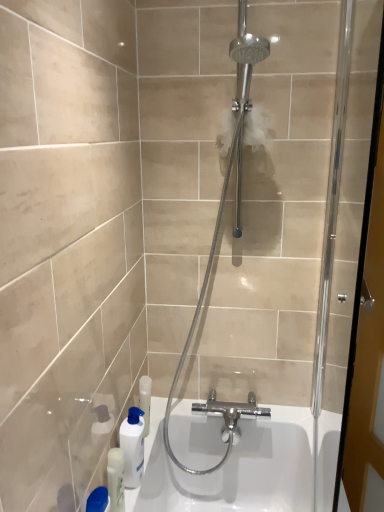
What do you see at coordinates (133, 447) in the screenshot? I see `white glossy bottle at lower left` at bounding box center [133, 447].

Find the location of a particular element. Image resolution: width=384 pixels, height=512 pixels. polished chrome shower head at center is located at coordinates click(x=223, y=206).

In order to click on white glossy bottle at lower left in this screenshot , I will do `click(116, 479)`.

Considering the sizes of objects polished chrome shower head at center and white glossy bottle at lower left in the image provided, who is shorter, polished chrome shower head at center or white glossy bottle at lower left?

white glossy bottle at lower left.

From a real-world perspective, which object stands above the other?

From a 3D spatial view, polished chrome shower head at center is above.

From the image's perspective, between polished chrome shower head at center and white glossy bottle at lower left, who is located below?

white glossy bottle at lower left appears lower in the image.

From the image's perspective, relative to white glossy bottle at lower left, is white glossy bottle at lower left above or below?

white glossy bottle at lower left is above white glossy bottle at lower left.

Is white glossy bottle at lower left at the right side of white glossy bottle at lower left?

Yes, white glossy bottle at lower left is to the right of white glossy bottle at lower left.

Looking at the image, does white glossy bottle at lower left seem bigger or smaller compared to white glossy bottle at lower left?

In the image, white glossy bottle at lower left appears to be larger than white glossy bottle at lower left.

From a real-world perspective, which object stands above the other?

From a 3D spatial view, polished chrome shower head at center is above.

Locate an element on the screen. toiletry to the left of polished chrome shower head at center is located at coordinates (116, 479).

Considering their positions, is polished chrome shower head at center located in front of or behind white glossy bottle at lower left?

polished chrome shower head at center is positioned closer to the viewer than white glossy bottle at lower left.

Is white glossy bottle at lower left to the left or to the right of polished chrome shower head at center in the image?

In the image, white glossy bottle at lower left appears on the left side of polished chrome shower head at center.

Is white glossy bottle at lower left spatially inside polished chrome shower head at center, or outside of it?

white glossy bottle at lower left is not enclosed by polished chrome shower head at center.

From the picture: Relative to polished chrome shower head at center, is white glossy bottle at lower left in front or behind?

Visually, white glossy bottle at lower left is located behind polished chrome shower head at center.

Consider the image. Which of these two, white glossy bottle at lower left or polished chrome shower head at center, stands taller?

polished chrome shower head at center is taller.

Would you say white glossy bottle at lower left is outside polished chrome shower head at center?

Yes, white glossy bottle at lower left is not within polished chrome shower head at center.

From the image's perspective, which object appears higher, white glossy bottle at lower left or polished chrome shower head at center?

polished chrome shower head at center is shown above in the image.

Is white glossy bottle at lower left at the right side of polished chrome shower head at center?

In fact, white glossy bottle at lower left is to the left of polished chrome shower head at center.

Consider the image. Is white glossy bottle at lower left positioned beyond the bounds of white glossy bottle at lower left?

Indeed, white glossy bottle at lower left is completely outside white glossy bottle at lower left.

Can you confirm if white glossy bottle at lower left is taller than white glossy bottle at lower left?

No.

Is point (113, 500) closer or farther from the camera than point (134, 450)?

Point (113, 500) is closer to the camera than point (134, 450).

Relative to white glossy bottle at lower left, is white glossy bottle at lower left in front or behind?

white glossy bottle at lower left is in front of white glossy bottle at lower left.

In the image, there is a polished chrome shower head at center. Where is `cleaning product below it (from the image's perspective)`? The height and width of the screenshot is (512, 384). cleaning product below it (from the image's perspective) is located at coordinates (133, 447).

Locate an element on the screen. This screenshot has width=384, height=512. toiletry that is under the white glossy bottle at lower left (from a real-world perspective) is located at coordinates point(116,479).

When comparing their distances from white glossy bottle at lower left, does white glossy bottle at lower left or polished chrome shower head at center seem closer?

white glossy bottle at lower left is closer to white glossy bottle at lower left.

Looking at the image, which one is located closer to white glossy bottle at lower left, white glossy bottle at lower left or polished chrome shower head at center?

white glossy bottle at lower left lies closer to white glossy bottle at lower left than the other object.

Considering their positions, is white glossy bottle at lower left positioned closer to polished chrome shower head at center than white glossy bottle at lower left?

white glossy bottle at lower left is closer to polished chrome shower head at center.

Which object lies further to the anchor point white glossy bottle at lower left, polished chrome shower head at center or white glossy bottle at lower left?

Based on the image, polished chrome shower head at center appears to be further to white glossy bottle at lower left.

Considering their positions, is white glossy bottle at lower left positioned closer to polished chrome shower head at center than white glossy bottle at lower left?

Among the two, white glossy bottle at lower left is located nearer to polished chrome shower head at center.

Based on their spatial positions, is polished chrome shower head at center or white glossy bottle at lower left further from white glossy bottle at lower left?

polished chrome shower head at center is positioned further to the anchor white glossy bottle at lower left.

Where is `cleaning product between polished chrome shower head at center and white glossy bottle at lower left vertically`? Image resolution: width=384 pixels, height=512 pixels. cleaning product between polished chrome shower head at center and white glossy bottle at lower left vertically is located at coordinates (133, 447).